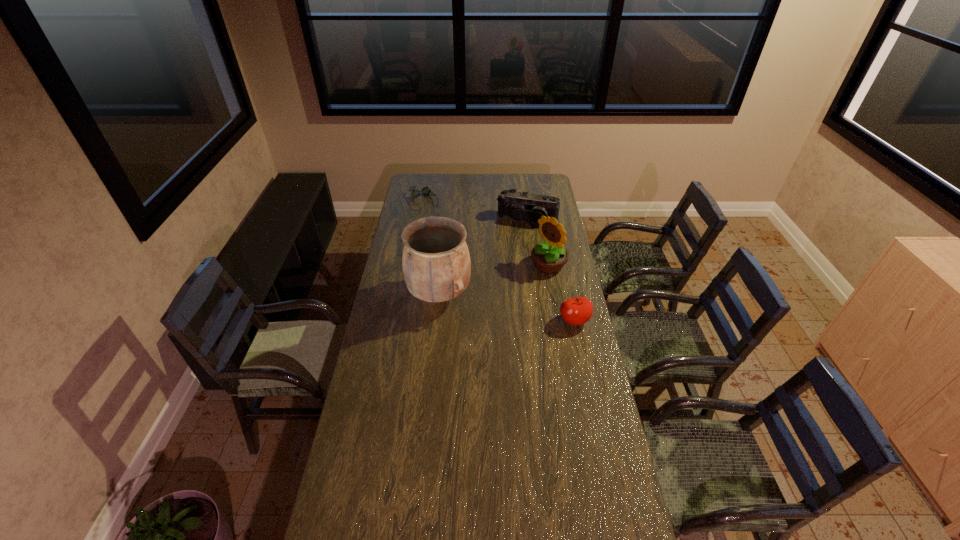
This screenshot has height=540, width=960. What are the coordinates of `camcorder at the right edge` in the screenshot? It's located at (524, 206).

Image resolution: width=960 pixels, height=540 pixels. I want to click on sunflower situated at the right edge, so click(x=549, y=257).

The image size is (960, 540). Identify the location of object that is at the far left corner. (425, 191).

This screenshot has height=540, width=960. In the image, there is a desktop. Find the location of `vacant space at the far edge`. vacant space at the far edge is located at coordinates (503, 184).

What are the coordinates of `free spot at the near edge of the desktop` in the screenshot? It's located at (526, 507).

In the image, there is a desktop. Identify the location of vacant space at the left edge. (397, 410).

This screenshot has height=540, width=960. I want to click on free space at the right edge of the desktop, so click(595, 416).

I want to click on vacant space at the far right corner of the desktop, so pos(545,193).

Where is `vacant area between the second tallest object and the camcorder`? vacant area between the second tallest object and the camcorder is located at coordinates (538, 242).

Identify the location of vacant space that's between the second tallest object and the camcorder. (538, 242).